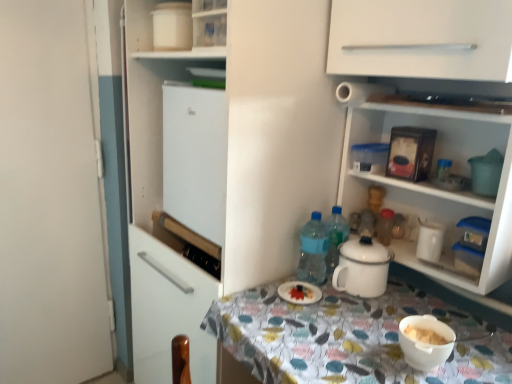
Question: From a real-world perspective, is white glossy plate at center above or below white matte cabinet at upper center?

Choices:
 (A) below
 (B) above

Answer: (A)

Question: Is white glossy plate at center to the left or to the right of white matte cabinet at upper center in the image?

Choices:
 (A) left
 (B) right

Answer: (B)

Question: Estimate the real-world distances between objects in this image. Which object is closer to the white matte cabinet at upper center?

Choices:
 (A) white glossy plate at center
 (B) white glossy shelves at upper right
 (C) blue plastic bottle at center, the 1th bottle viewed from the left
 (D) white glossy electric kettle at right
 (E) white enamel pot at center

Answer: (C)

Question: Which object is the farthest from the white enamel pot at center?

Choices:
 (A) blue plastic bottle at center, the 1th bottle viewed from the left
 (B) white glossy electric kettle at right
 (C) translucent plastic bottle at upper right, marked as the first bottle in a right-to-left arrangement
 (D) white matte cabinet at upper center
 (E) white matte cabinet at upper center

Answer: (D)